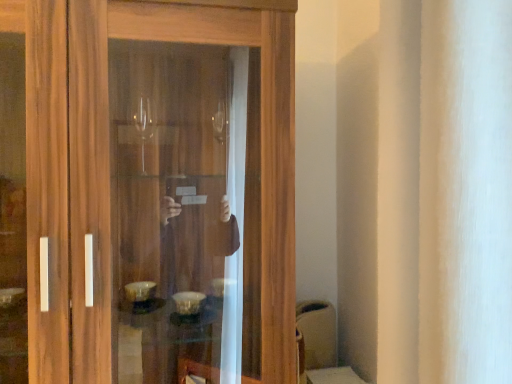
Where is `wooden cabinet at center`? wooden cabinet at center is located at coordinates (261, 134).

What do you see at coordinates (261, 134) in the screenshot? I see `wooden cabinet at center` at bounding box center [261, 134].

Image resolution: width=512 pixels, height=384 pixels. In order to click on wooden cabinet at center in this screenshot , I will do `click(261, 134)`.